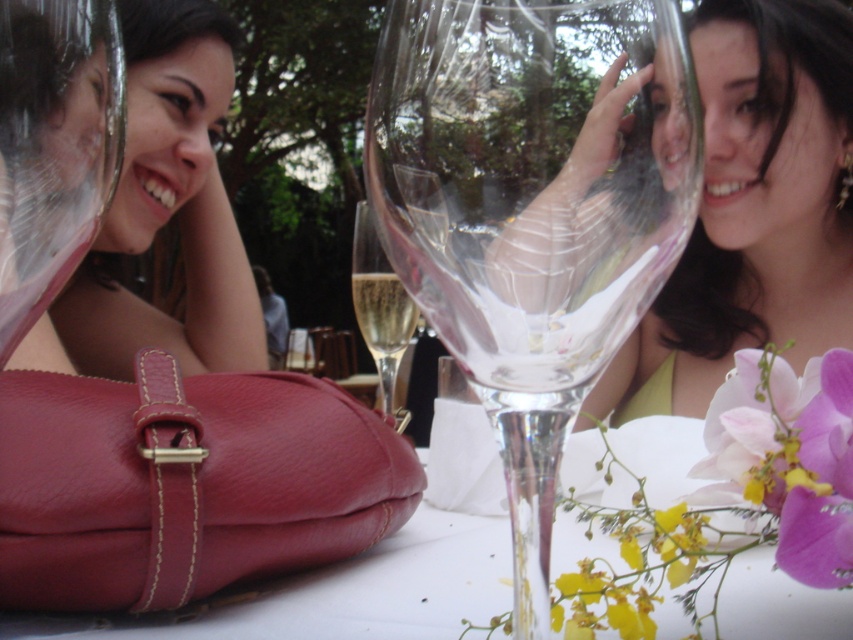
You are a photographer who wants to ensure both the matte gold necklace at upper center and the pink silk flower at lower right are clearly visible in your photo. Considering their sizes, which object might require closer focus to capture details without being too small?

The matte gold necklace at upper center has a larger size compared to the pink silk flower at lower right, so it might require closer focus to capture details without being too small.

You are a photographer setting up for a shoot in this outdoor dining scene. You need to place a 12cm wide decorative item between the leather handbag at center and the translucent glass champagne flute at center. Based on their widths, will there be enough space?

The leather handbag at center might be wider than the translucent glass champagne flute at center. Since the exact width difference isn